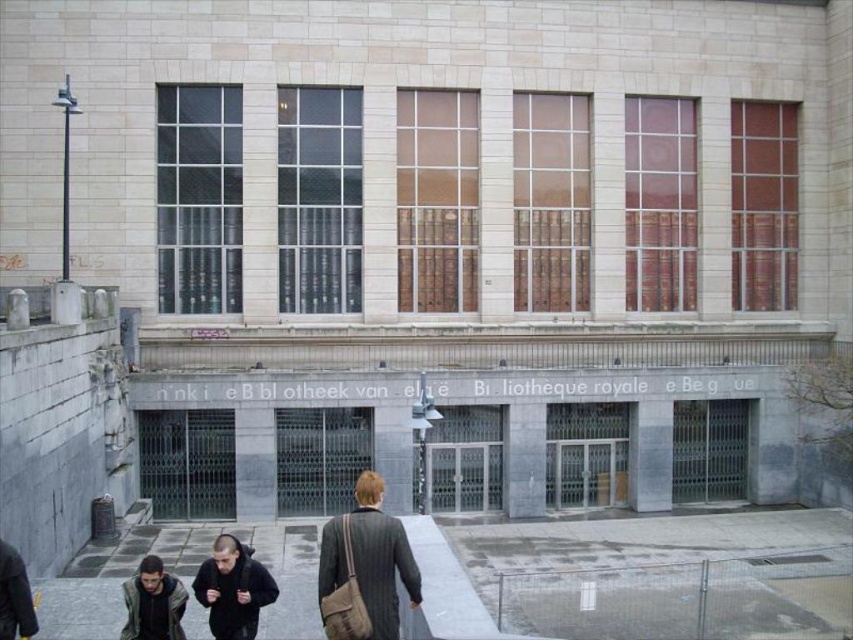
Which is more to the right, smooth concrete pavement at lower center or dark gray jacket at lower left?

Positioned to the right is dark gray jacket at lower left.

Does smooth concrete pavement at lower center have a greater height compared to dark gray jacket at lower left?

Correct, smooth concrete pavement at lower center is much taller as dark gray jacket at lower left.

Does point (422, 568) come closer to viewer compared to point (157, 628)?

Yes, point (422, 568) is in front of point (157, 628).

This screenshot has height=640, width=853. Find the location of `smooth concrete pavement at lower center`. smooth concrete pavement at lower center is located at coordinates (183, 579).

Does striped wool coat at center have a greater height compared to dark gray fabric jacket at lower center?

Yes.

What do you see at coordinates (364, 568) in the screenshot? I see `striped wool coat at center` at bounding box center [364, 568].

You are a GUI agent. You are given a task and a screenshot of the screen. Output one action in this format:
    pyautogui.click(x=<x>, y=<y>)
    Task: Click on the striped wool coat at center
    The width and height of the screenshot is (853, 640).
    Given the screenshot: What is the action you would take?
    pyautogui.click(x=364, y=568)

Based on the photo, does smooth concrete pavement at lower center appear over striped wool coat at center?

Actually, smooth concrete pavement at lower center is below striped wool coat at center.

Is smooth concrete pavement at lower center thinner than striped wool coat at center?

Incorrect, smooth concrete pavement at lower center's width is not less than striped wool coat at center's.

At what (x,y) coordinates should I click in order to perform the action: click on smooth concrete pavement at lower center. Please return your answer as a coordinate pair (x, y). Looking at the image, I should click on (183, 579).

Identify the location of smooth concrete pavement at lower center. (183, 579).